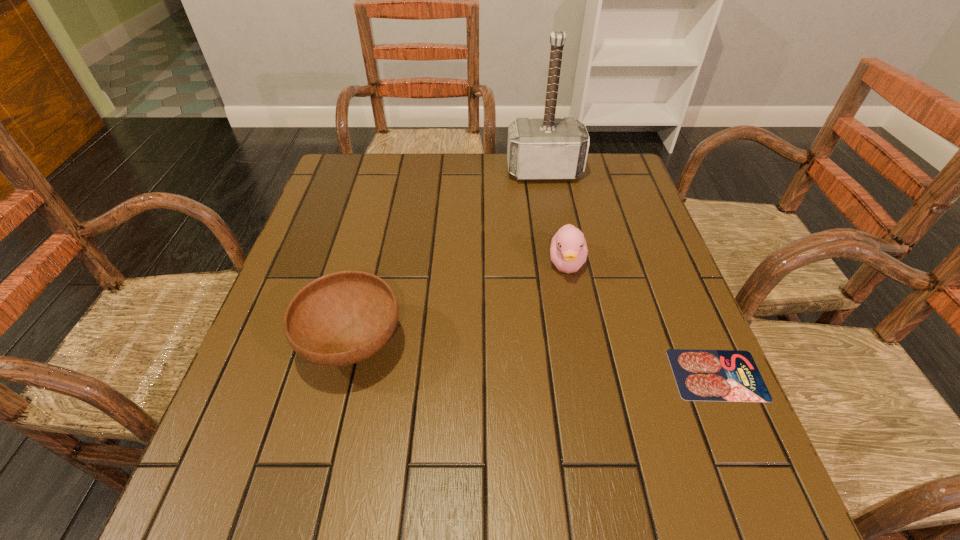
Find the location of a particular element. vacant space located on the front-facing side of the third nearest object is located at coordinates (572, 316).

At what (x,y) coordinates should I click in order to perform the action: click on vacant area situated for striking with the head of the tallest object. Please return your answer as a coordinate pair (x, y). Image resolution: width=960 pixels, height=540 pixels. Looking at the image, I should click on (557, 234).

Where is `vacant space situated for striking with the head of the tallest object`? This screenshot has height=540, width=960. vacant space situated for striking with the head of the tallest object is located at coordinates (565, 273).

Locate an element on the screen. This screenshot has width=960, height=540. free region located for striking with the head of the tallest object is located at coordinates (549, 195).

Where is `object that is at the far edge`? This screenshot has width=960, height=540. object that is at the far edge is located at coordinates (549, 148).

In order to click on object located in the near edge section of the desktop in this screenshot , I will do `click(701, 375)`.

You are a GUI agent. You are given a task and a screenshot of the screen. Output one action in this format:
    pyautogui.click(x=<x>, y=<y>)
    Task: Click on the object that is at the left edge
    Image resolution: width=960 pixels, height=540 pixels.
    Given the screenshot: What is the action you would take?
    pyautogui.click(x=342, y=318)

This screenshot has height=540, width=960. Identify the location of salami present at the right edge. (701, 375).

Where is `hammer positioned at the right edge`? The image size is (960, 540). hammer positioned at the right edge is located at coordinates click(549, 148).

Locate an element on the screen. The image size is (960, 540). object at the far right corner is located at coordinates (549, 148).